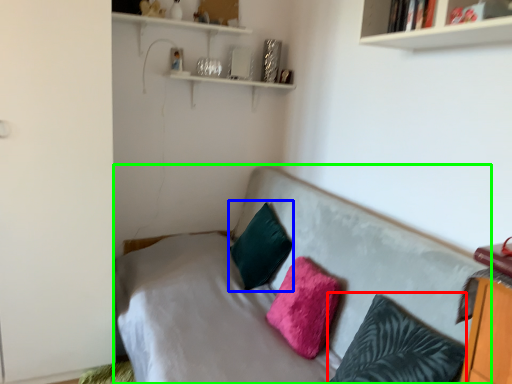
Question: Which is farther away from pillow (highlighted by a red box)? pillow (highlighted by a blue box) or studio couch (highlighted by a green box)?

Choices:
 (A) pillow
 (B) studio couch

Answer: (A)